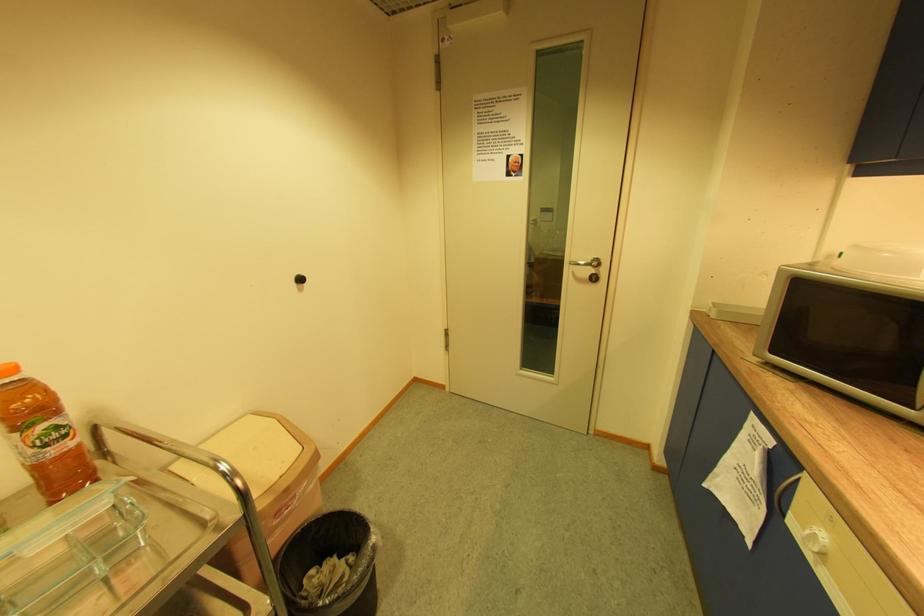
Describe the element at coordinates (205, 492) in the screenshot. I see `the metal cart handle` at that location.